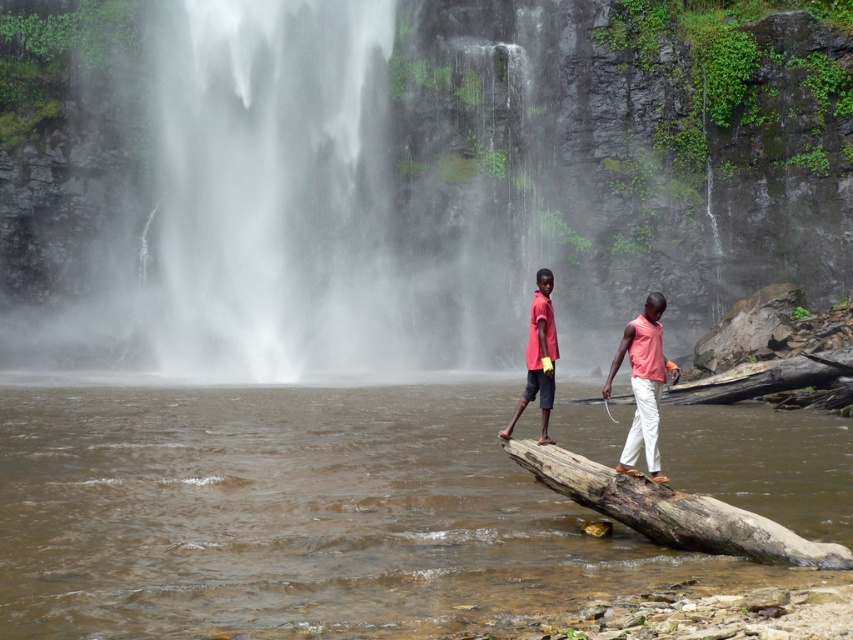
Question: Which point appears closest to the camera in this image?

Choices:
 (A) (653, 308)
 (B) (567, 452)

Answer: (B)

Question: Can you confirm if brown weathered log at center is smaller than matte red shorts at center?

Choices:
 (A) yes
 (B) no

Answer: (A)

Question: Is brown muddy water at center smaller than brown weathered log at center?

Choices:
 (A) yes
 (B) no

Answer: (B)

Question: Based on their relative distances, which object is nearer to the brown muddy water at center?

Choices:
 (A) matte red shorts at center
 (B) white misty waterfall at center

Answer: (A)

Question: Does matte pink shirt at center have a lesser width compared to pink cotton shirt at right?

Choices:
 (A) yes
 (B) no

Answer: (B)

Question: Among these points, which one is nearest to the camera?

Choices:
 (A) (646, 362)
 (B) (648, 440)
 (C) (552, 392)

Answer: (B)